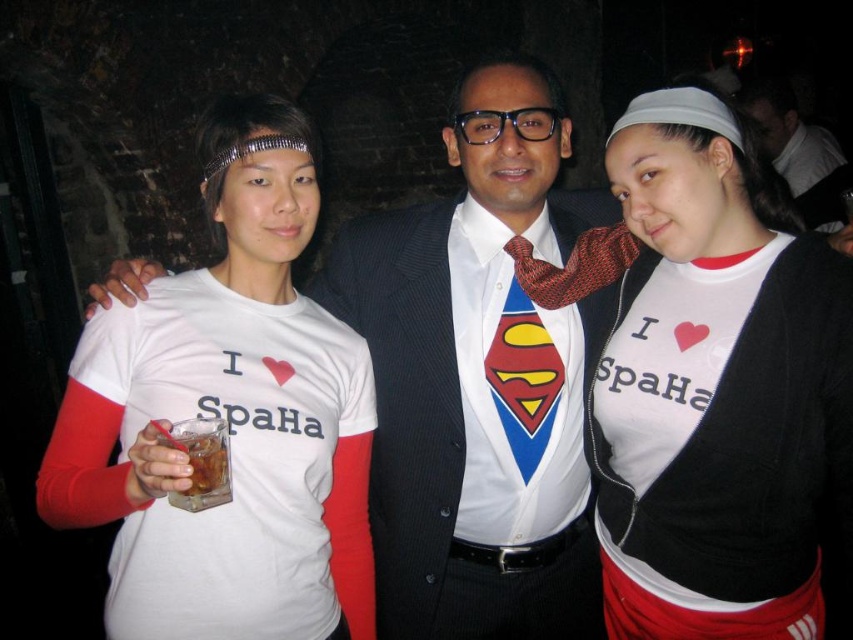
You are a photographer at the event and want to ensure both the red textured tie at center and the translucent glass drink at lower left are clearly visible in your photo. Which object should you focus on to ensure proper focus, considering their height?

You should focus on the red textured tie at center because it is much taller than the translucent glass drink at lower left, making it more prominent in the frame.

You are standing at the camera position and want to take a photo of the three people. The point at coordinates point (799, 412) is 4.81 feet away from you. If you need to adjust your focus to capture the point clearly, what distance should you set your camera focus to?

You should set the camera focus to 4.81 feet because the point at coordinates point (799, 412) is 4.81 feet away from the camera.

You are at a party and want to place the translucent glass drink at lower left on a table next to the matte black suit at center. Considering their sizes, will the drink fit comfortably next to the suit?

The matte black suit at center is wider than the translucent glass drink at lower left, so the drink should fit comfortably next to the suit since it is narrower.